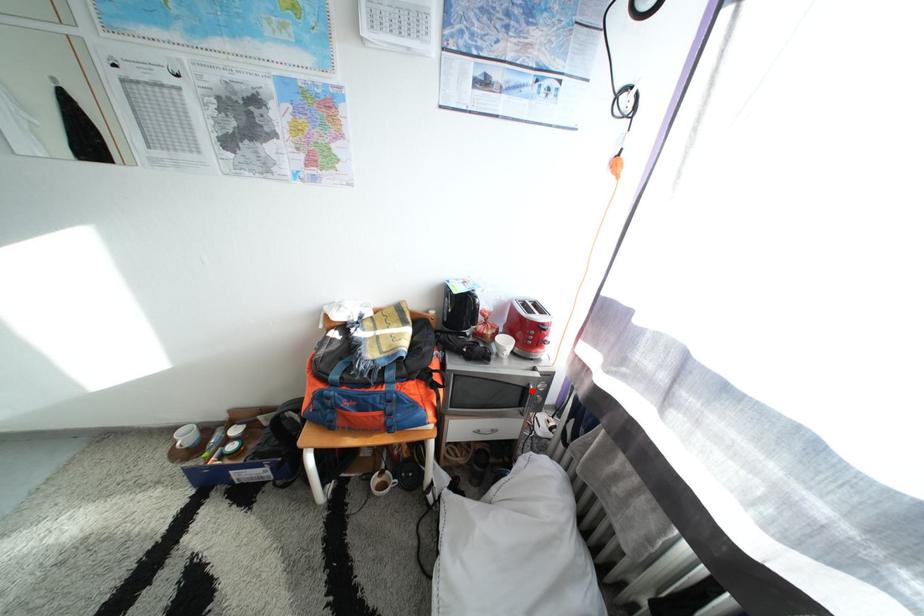
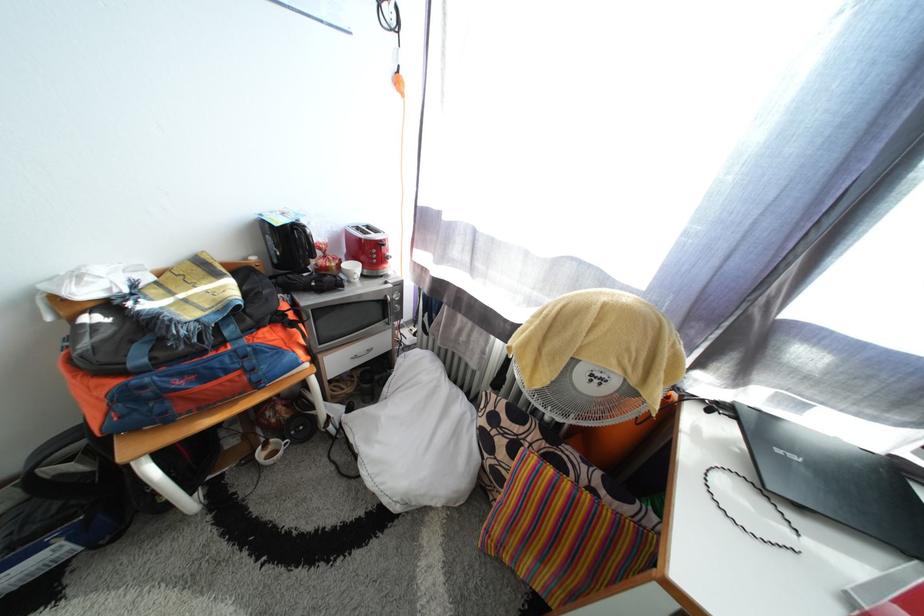
Question: I am providing you with two images of the same scene from different viewpoints. In image1, a red point is highlighted. Considering the same 3D point in image2, which of the following is correct?

Choices:
 (A) It is closer
 (B) It is farther

Answer: (A)